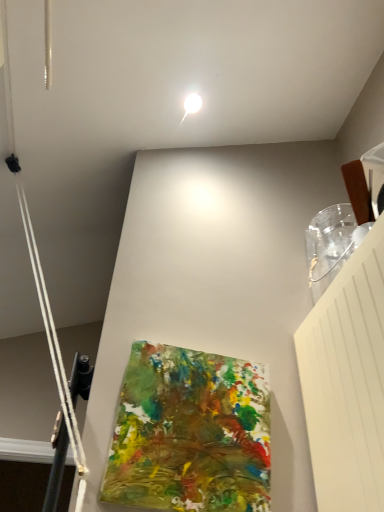
Where is `white glossy droplight at upper center`? white glossy droplight at upper center is located at coordinates (192, 103).

The width and height of the screenshot is (384, 512). Describe the element at coordinates (192, 103) in the screenshot. I see `white glossy droplight at upper center` at that location.

Describe the element at coordinates (190, 433) in the screenshot. I see `abstract painting at center` at that location.

Measure the distance between abstract painting at center and camera.

abstract painting at center is 38.10 inches away from camera.

Identify the location of abstract painting at center. This screenshot has width=384, height=512. (190, 433).

Image resolution: width=384 pixels, height=512 pixels. What are the coordinates of `white glossy droplight at upper center` in the screenshot? It's located at (192, 103).

Considering the relative positions of white glossy droplight at upper center and abstract painting at center in the image provided, is white glossy droplight at upper center to the left or to the right of abstract painting at center?

Clearly, white glossy droplight at upper center is on the left of abstract painting at center in the image.

Is the depth of white glossy droplight at upper center greater than that of abstract painting at center?

Yes, white glossy droplight at upper center is further from the camera.

Does point (195, 110) come in front of point (184, 382)?

No.

From the image's perspective, who appears lower, white glossy droplight at upper center or abstract painting at center?

abstract painting at center is shown below in the image.

From a real-world perspective, between white glossy droplight at upper center and abstract painting at center, who is vertically lower?

abstract painting at center is physically lower.

Does white glossy droplight at upper center have a greater width compared to abstract painting at center?

Correct, the width of white glossy droplight at upper center exceeds that of abstract painting at center.

Can you confirm if white glossy droplight at upper center is shorter than abstract painting at center?

Yes, white glossy droplight at upper center is shorter than abstract painting at center.

Considering the sizes of objects white glossy droplight at upper center and abstract painting at center in the image provided, who is smaller, white glossy droplight at upper center or abstract painting at center?

white glossy droplight at upper center.

Consider the image. Could abstract painting at center be considered to be inside white glossy droplight at upper center?

That's incorrect, abstract painting at center is not inside white glossy droplight at upper center.

Would you consider white glossy droplight at upper center to be distant from abstract painting at center?

white glossy droplight at upper center is positioned a significant distance from abstract painting at center.

Is white glossy droplight at upper center positioned with its back to abstract painting at center?

No, white glossy droplight at upper center's orientation is not away from abstract painting at center.

Can you tell me how much white glossy droplight at upper center and abstract painting at center differ in facing direction?

180 degrees.

How far apart are white glossy droplight at upper center and abstract painting at center?

They are 1.17 meters apart.

Where is `droplight above the abstract painting at center (from the image's perspective)`? The image size is (384, 512). droplight above the abstract painting at center (from the image's perspective) is located at coordinates (192, 103).

Visually, is abstract painting at center positioned to the left or to the right of white glossy droplight at upper center?

abstract painting at center is to the right of white glossy droplight at upper center.

Considering the relative positions of abstract painting at center and white glossy droplight at upper center in the image provided, is abstract painting at center behind white glossy droplight at upper center?

No, it is in front of white glossy droplight at upper center.

Between point (166, 373) and point (195, 101), which one is positioned in front?

Point (166, 373)

From the image's perspective, is abstract painting at center beneath white glossy droplight at upper center?

Yes, from the image's perspective, abstract painting at center is beneath white glossy droplight at upper center.

From a real-world perspective, is abstract painting at center positioned under white glossy droplight at upper center based on gravity?

Yes, from a real-world perspective, abstract painting at center is below white glossy droplight at upper center.

Which of these two, abstract painting at center or white glossy droplight at upper center, is thinner?

With smaller width is abstract painting at center.

In terms of height, does abstract painting at center look taller or shorter compared to white glossy droplight at upper center?

In the image, abstract painting at center appears to be taller than white glossy droplight at upper center.

In terms of size, does abstract painting at center appear bigger or smaller than white glossy droplight at upper center?

In the image, abstract painting at center appears to be larger than white glossy droplight at upper center.

Is abstract painting at center positioned beyond the bounds of white glossy droplight at upper center?

Yes, abstract painting at center is located beyond the bounds of white glossy droplight at upper center.

Are abstract painting at center and white glossy droplight at upper center making contact?

abstract painting at center is not next to white glossy droplight at upper center, and they're not touching.

Is abstract painting at center facing towards white glossy droplight at upper center?

No, abstract painting at center is not aimed at white glossy droplight at upper center.

How many degrees apart are the facing directions of abstract painting at center and white glossy droplight at upper center?

180 degrees.

Image resolution: width=384 pixels, height=512 pixels. Find the location of `art on the right of the white glossy droplight at upper center`. art on the right of the white glossy droplight at upper center is located at coordinates (190, 433).

Locate an element on the screen. This screenshot has height=512, width=384. art on the right side of white glossy droplight at upper center is located at coordinates (190, 433).

Locate an element on the screen. This screenshot has width=384, height=512. droplight located above the abstract painting at center (from a real-world perspective) is located at coordinates (192, 103).